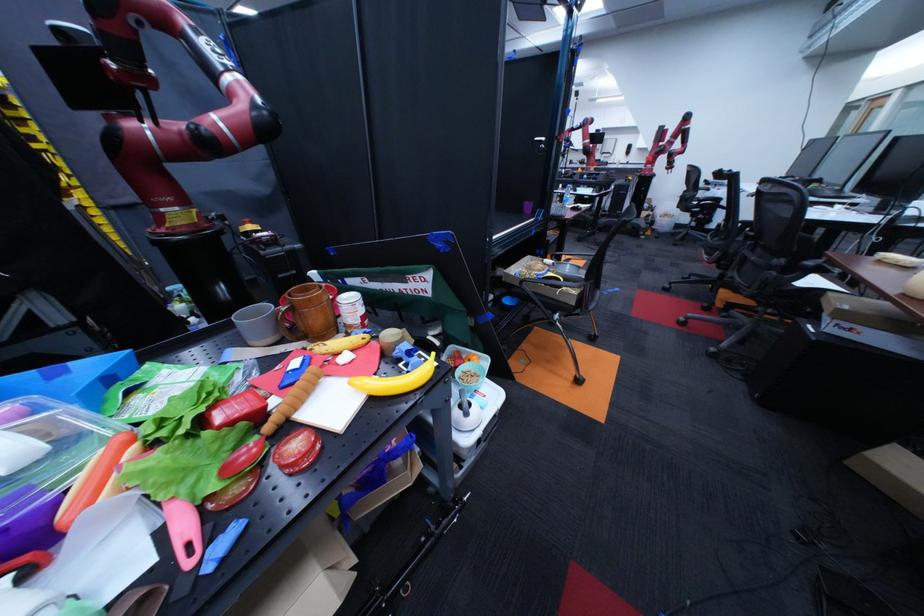
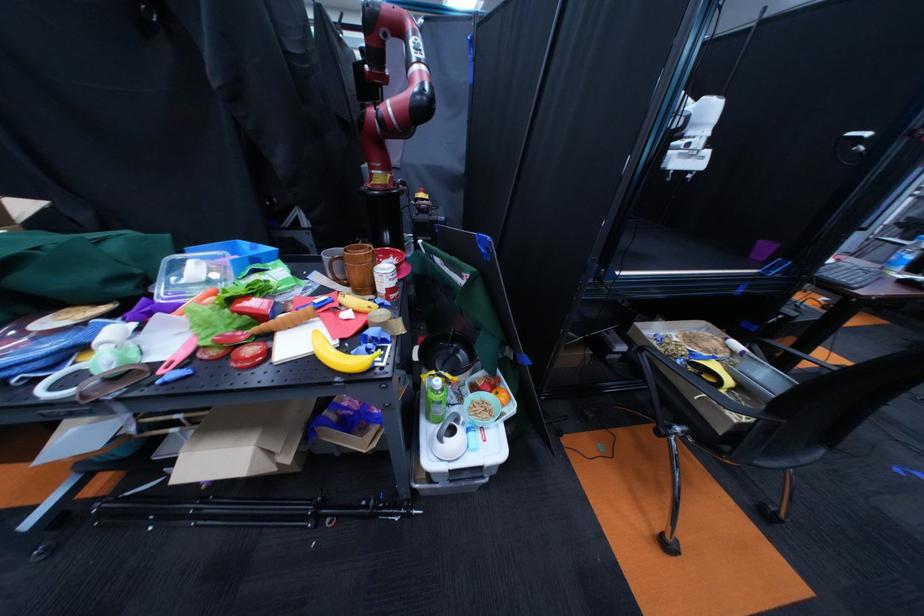
Find the pixel in the second image that matches pixel 605 341 in the first image.

(776, 517)